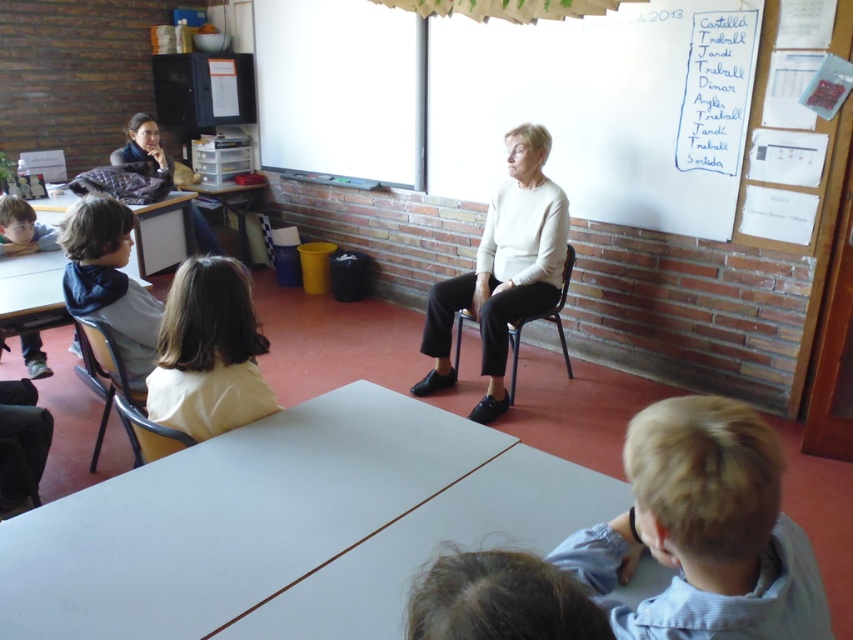
Question: Estimate the real-world distances between objects in this image. Which object is farther from the matte plastic chair at lower left?

Choices:
 (A) dark blue hoodie at left
 (B) white glossy table at center
 (C) wooden chair at center
 (D) blonde hair at lower right

Answer: (C)

Question: Is white glossy table at lower center bigger than light brown wooden desk at left?

Choices:
 (A) yes
 (B) no

Answer: (A)

Question: Which point is closer to the camera?

Choices:
 (A) dark brown hair at lower center
 (B) wooden chair at center
 (C) light yellow shirt at center

Answer: (A)

Question: Which object is farther from the camera taking this photo?

Choices:
 (A) white glossy table at center
 (B) wooden chair at center

Answer: (B)

Question: Does blonde hair at lower right have a greater width compared to wooden chair at center?

Choices:
 (A) yes
 (B) no

Answer: (B)

Question: Is matte black jacket at upper left to the right of matte plastic chair at lower left from the viewer's perspective?

Choices:
 (A) yes
 (B) no

Answer: (B)